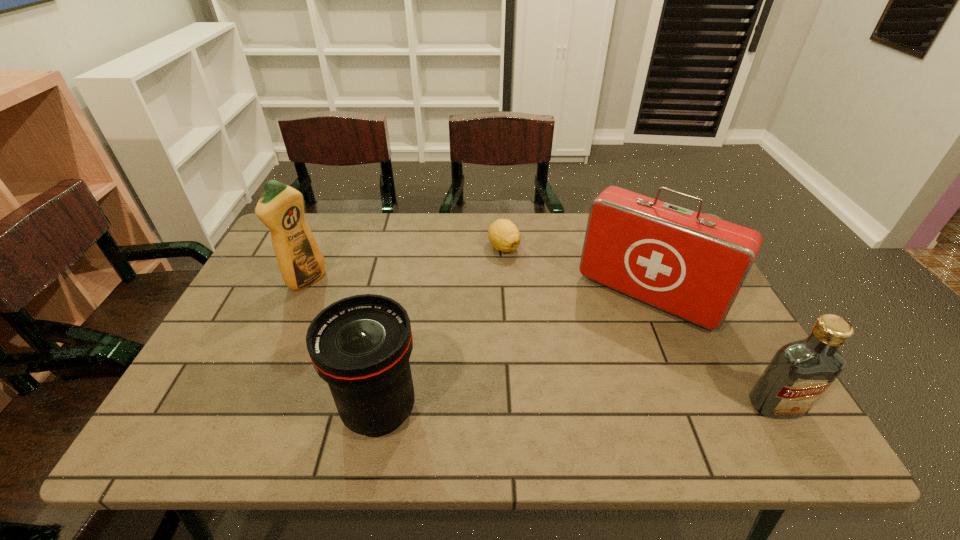
Where is `vodka that is at the right edge`? Image resolution: width=960 pixels, height=540 pixels. vodka that is at the right edge is located at coordinates (800, 372).

Where is `the first-aid kit that is positioned at the right edge`? The height and width of the screenshot is (540, 960). the first-aid kit that is positioned at the right edge is located at coordinates (692, 265).

The height and width of the screenshot is (540, 960). Find the location of `object that is positioned at the near right corner`. object that is positioned at the near right corner is located at coordinates (800, 372).

Image resolution: width=960 pixels, height=540 pixels. Identify the location of vacant position at the far edge of the desktop. (562, 233).

The width and height of the screenshot is (960, 540). In order to click on blank space at the near edge in this screenshot , I will do `click(501, 386)`.

In order to click on blank space at the left edge of the desktop in this screenshot , I will do `click(248, 304)`.

The image size is (960, 540). Find the location of `vacant region at the right edge of the desktop`. vacant region at the right edge of the desktop is located at coordinates (719, 373).

In the image, there is a desktop. In order to click on blank space at the near left corner in this screenshot , I will do `click(189, 400)`.

At what (x,y) coordinates should I click in order to perform the action: click on free area in between the first-aid kit and the detergent. Please return your answer as a coordinate pair (x, y). Image resolution: width=960 pixels, height=540 pixels. Looking at the image, I should click on (477, 288).

This screenshot has width=960, height=540. I want to click on vacant area between the first-aid kit and the farthest object, so click(x=576, y=272).